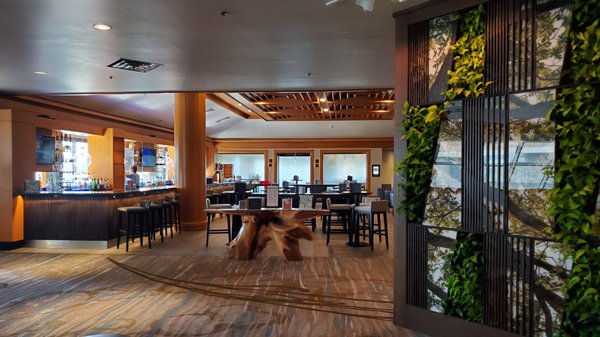
Identify the location of bottles of liquor. point(76,181), point(93,183), point(101,183).